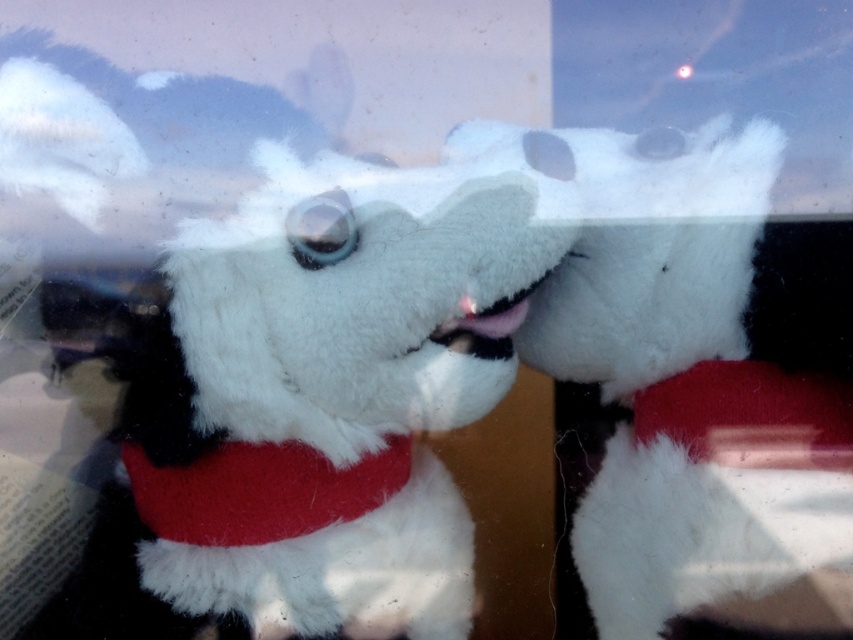
From the picture: You are a customer in a store looking at two plush toys displayed in a case. You see a white plush dog at center and a red plush neckband at center. Which toy is to the left of the other?

The red plush neckband at center is to the left of the white plush dog at center because the white plush dog at center is positioned on the right side of the red plush neckband at center.

You are a photographer standing 1.2 meters away from the camera. You want to take a picture of the white plush dog at center. Can you reach the dog to adjust its position without moving the camera?

The distance between the white plush dog at center and the camera is 1.03 meters. Since you are 1.2 meters away from the camera, you can reach the dog by extending your arm to the dog, which is within your reach.

You are designing a gift box that needs to accommodate both the white plush dog at center and the red plush neckband at center. The box must be just large enough to hold both items without extra space. Based on their sizes, what should be the minimum width of the box?

The white plush dog at center is wider than the red plush neckband at center. Therefore, the minimum width of the box should be equal to the width of the white plush dog at center to accommodate both items.